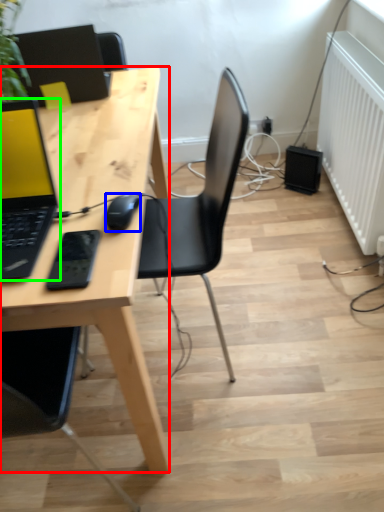
Question: Considering the real-world distances, which object is closest to desk (highlighted by a red box)? mouse (highlighted by a blue box) or laptop (highlighted by a green box).

Choices:
 (A) mouse
 (B) laptop

Answer: (B)